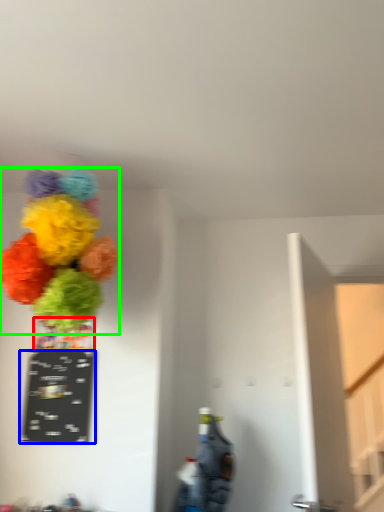
Question: Estimate the real-world distances between objects in this image. Which object is closer to vase (highlighted by a red box), writing (highlighted by a blue box) or flower (highlighted by a green box)?

Choices:
 (A) writing
 (B) flower

Answer: (A)